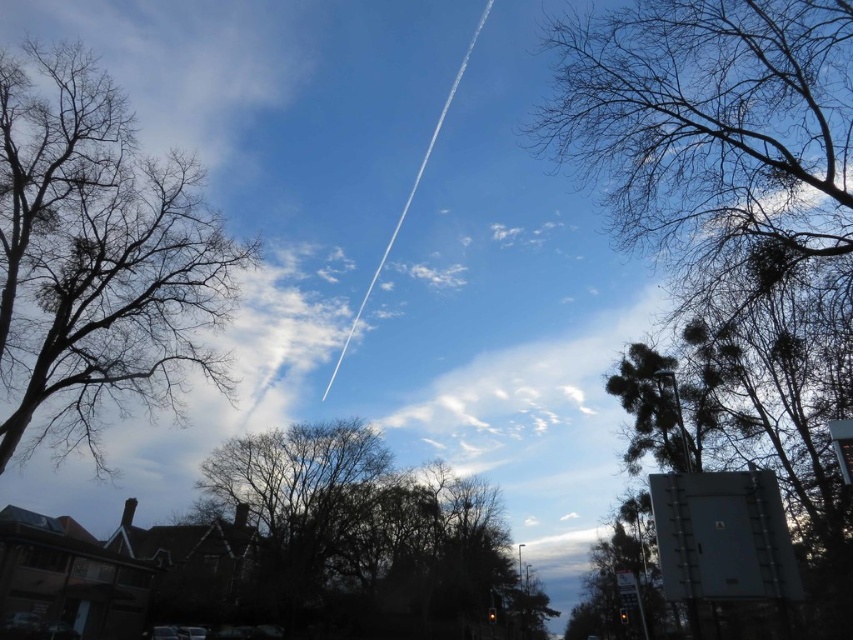
Who is more forward, (119,221) or (387,467)?

Point (119,221) is more forward.

Which is below, bare branches at upper left or brown leafless tree at center?

brown leafless tree at center is below.

Locate an element on the screen. Image resolution: width=853 pixels, height=640 pixels. bare branches at upper left is located at coordinates (97, 259).

Where is `bare branches at upper left`? bare branches at upper left is located at coordinates (97, 259).